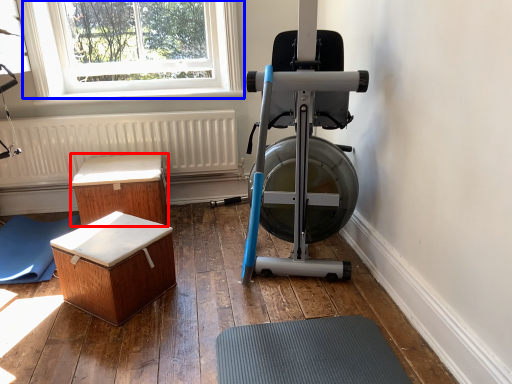
Question: Among these objects, which one is farthest to the camera, furniture (highlighted by a red box) or window (highlighted by a blue box)?

Choices:
 (A) furniture
 (B) window

Answer: (B)